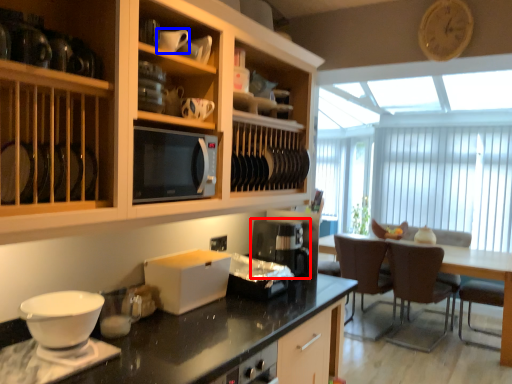
Question: Which object is further to the camera taking this photo, kitchen appliance (highlighted by a red box) or tableware (highlighted by a blue box)?

Choices:
 (A) kitchen appliance
 (B) tableware

Answer: (A)